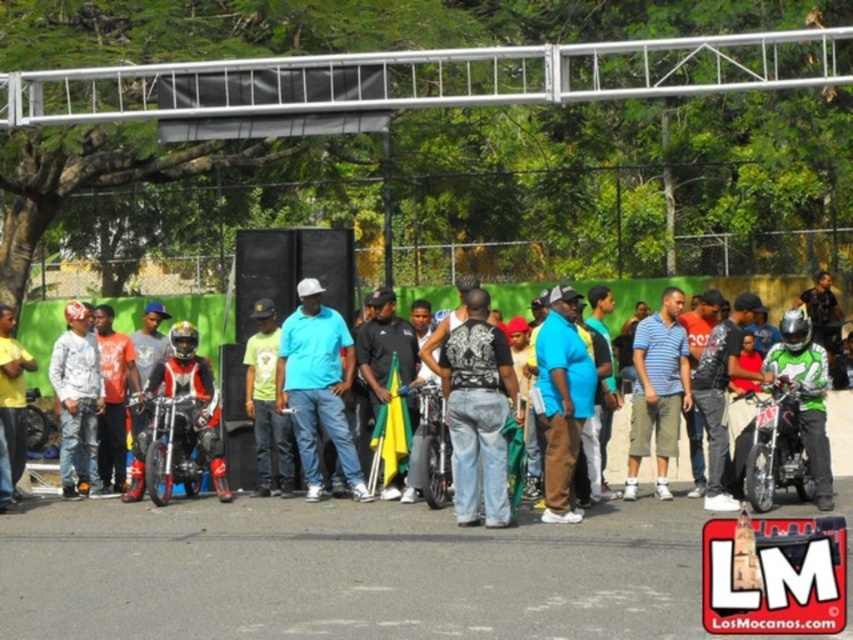
Does shiny metallic motorcycle at center come in front of yellow t-shirt at center?

Yes.

Is shiny metallic motorcycle at center wider than yellow t-shirt at center?

Indeed, shiny metallic motorcycle at center has a greater width compared to yellow t-shirt at center.

This screenshot has width=853, height=640. Find the location of `shiny metallic motorcycle at center`. shiny metallic motorcycle at center is located at coordinates (177, 449).

Can you confirm if matte black motorcycle at center is thinner than yellow t-shirt at center?

In fact, matte black motorcycle at center might be wider than yellow t-shirt at center.

Which is behind, point (608, 282) or point (19, 362)?

The point (608, 282) is more distant.

Which is in front, point (33, 348) or point (33, 364)?

Point (33, 364)

Identify the location of matte black motorcycle at center. The image size is (853, 640). (700, 289).

Does shiny metallic motorcycle at center have a greater width compared to shiny metallic motorcycle at right?

Yes.

Can you confirm if shiny metallic motorcycle at center is positioned to the left of shiny metallic motorcycle at right?

Indeed, shiny metallic motorcycle at center is positioned on the left side of shiny metallic motorcycle at right.

Does point (202, 460) come farther from viewer compared to point (804, 458)?

Yes.

The width and height of the screenshot is (853, 640). Find the location of `shiny metallic motorcycle at center`. shiny metallic motorcycle at center is located at coordinates (177, 449).